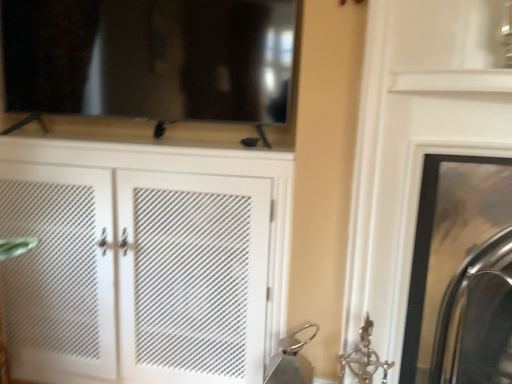
Question: Is white mesh cabinet at center outside metallic silver fireplace at right?

Choices:
 (A) no
 (B) yes

Answer: (B)

Question: Is white mesh cabinet at center at the left side of metallic silver fireplace at right?

Choices:
 (A) yes
 (B) no

Answer: (A)

Question: Does white mesh cabinet at center have a smaller size compared to metallic silver fireplace at right?

Choices:
 (A) no
 (B) yes

Answer: (A)

Question: Considering the relative sizes of white mesh cabinet at center and metallic silver fireplace at right in the image provided, is white mesh cabinet at center shorter than metallic silver fireplace at right?

Choices:
 (A) no
 (B) yes

Answer: (A)

Question: From the image's perspective, is white mesh cabinet at center located above metallic silver fireplace at right?

Choices:
 (A) no
 (B) yes

Answer: (B)

Question: Considering the relative sizes of white mesh cabinet at center and metallic silver fireplace at right in the image provided, is white mesh cabinet at center bigger than metallic silver fireplace at right?

Choices:
 (A) yes
 (B) no

Answer: (A)

Question: Considering the relative positions of metallic silver fireplace at right and white mesh cabinet at center in the image provided, is metallic silver fireplace at right to the right of white mesh cabinet at center from the viewer's perspective?

Choices:
 (A) yes
 (B) no

Answer: (A)

Question: Does metallic silver fireplace at right have a lesser height compared to white mesh cabinet at center?

Choices:
 (A) yes
 (B) no

Answer: (A)

Question: Considering the relative positions of metallic silver fireplace at right and white mesh cabinet at center in the image provided, is metallic silver fireplace at right in front of white mesh cabinet at center?

Choices:
 (A) no
 (B) yes

Answer: (B)

Question: Is metallic silver fireplace at right taller than white mesh cabinet at center?

Choices:
 (A) no
 (B) yes

Answer: (A)

Question: Is metallic silver fireplace at right far from white mesh cabinet at center?

Choices:
 (A) yes
 (B) no

Answer: (B)

Question: Is metallic silver fireplace at right at the left side of white mesh cabinet at center?

Choices:
 (A) no
 (B) yes

Answer: (A)

Question: Looking at their shapes, would you say white mesh cabinet at center is wider or thinner than metallic silver fireplace at right?

Choices:
 (A) thin
 (B) wide

Answer: (A)